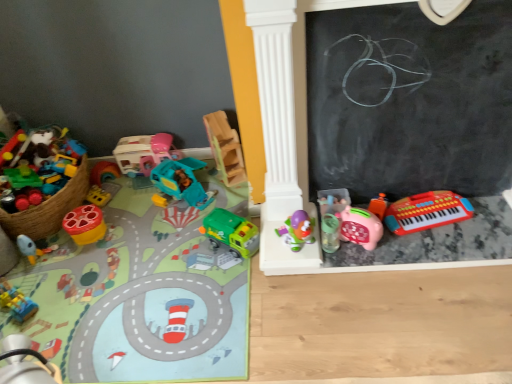
Identify the location of vacant area on the back side of plastic yellow car at lower left, positioned as the 2th toy in left-to-right order. (44, 273).